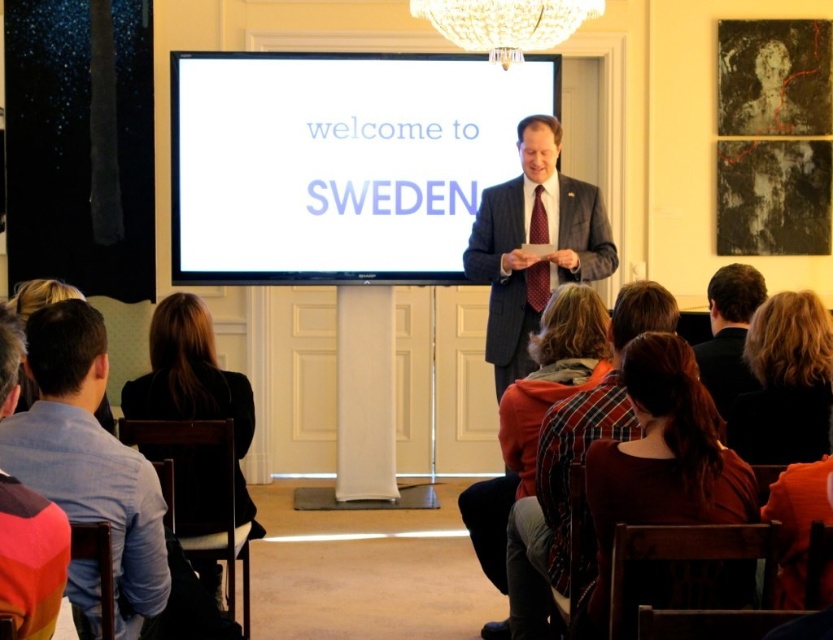
You are standing at the point marked as point (20, 528) and want to walk to the podium. The room has a width of 10 meters. Can you reach the podium without crossing the audience rows?

The distance between you and the podium is 1.86 meters. Since the room is 10 meters wide, there is enough space to navigate around the audience rows and reach the podium without crossing them.

You are an attendee at the event and want to take a photo of the speaker. The white glossy projection screen at center might reflect light. Where should you position yourself to avoid glare from the screen?

To avoid glare from the white glossy projection screen at center, position yourself so that the screen is not between you and the light source. Since the screen is located at point (338, 163), ensure you are not directly facing it when taking the photo. Alternatively, move to a side angle where the light reflecting off the screen does not reach your camera lens.

You are a photographer positioned at the back of the room. You want to capture a photo of the speaker at the podium without any obstructions. The multicolored fabric at lower left and the light brown hair at lower left are in your line of sight. Which object should you adjust your angle to avoid?

The multicolored fabric at lower left is taller than the light brown hair at lower left, so you should adjust your angle to avoid the multicolored fabric at lower left to ensure the speaker is visible.